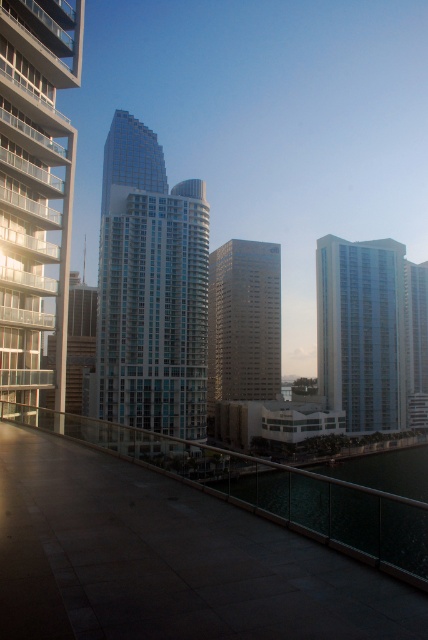
Looking at this image, you are standing on the rooftop walkway and want to take a photo of the glassy steel building at left. Where should you position yourself relative to the point marked at coordinates (35,189) to ensure the building is fully in frame?

You should position yourself at the point marked at coordinates (35,189) because that is where the glassy steel building at left is located.

Looking at this image, you are standing on the rooftop walkway and want to take a photo of the glassy steel skyscraper at center. If your camera has a focal length of 50mm and the skyscraper is 129.12 meters away, what is the approximate angle of view needed to capture the entire skyscraper in the frame?

The angle of view required to capture the entire glassy steel skyscraper at center would depend on the camera sensor size and the skyscraper height. However, since the distance is 129.12 meters, a 50mm lens typically has an angle of view of about 46 degrees diagonally, which might be sufficient if the skyscraper isn not excessively tall. For precise calculation, knowing the skyscraper height and sensor dimensions would be necessary.

You are a drone operator tasked with flying a drone between the glassy steel skyscraper at center and the gold reflective building at center. The drone has a maximum flight distance of 50 meters. Can the drone safely fly between them without exceeding its range?

The glassy steel skyscraper at center and gold reflective building at center are 49.08 meters apart. Since the drone has a maximum flight distance of 50 meters, it can safely fly between them without exceeding its range.